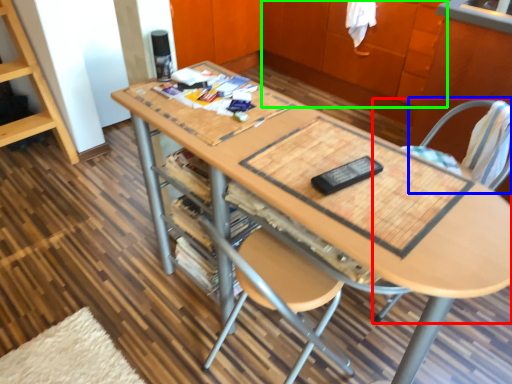
Question: Estimate the real-world distances between objects in this image. Which object is closer to chair (highlighted by a red box), swivel chair (highlighted by a blue box) or cabinetry (highlighted by a green box)?

Choices:
 (A) swivel chair
 (B) cabinetry

Answer: (A)